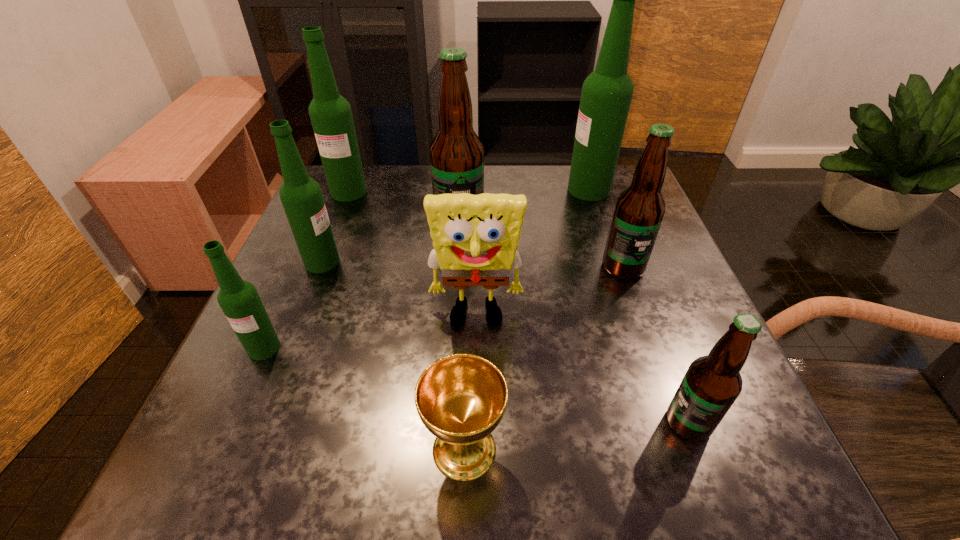
Identify which green beer bottle is the second nearest to the second biggest green beer bottle. Please provide its 2D coordinates. Your answer should be formatted as a tuple, i.e. [(x, y)], where the tuple contains the x and y coordinates of a point satisfying the conditions above.

[(239, 300)]

Locate which brown beer bottle is the second closest to the nearest green beer bottle. Please provide its 2D coordinates. Your answer should be formatted as a tuple, i.e. [(x, y)], where the tuple contains the x and y coordinates of a point satisfying the conditions above.

[(639, 210)]

Locate which brown beer bottle ranks in proximity to the nearest beer bottle. Please provide its 2D coordinates. Your answer should be formatted as a tuple, i.e. [(x, y)], where the tuple contains the x and y coordinates of a point satisfying the conditions above.

[(639, 210)]

I want to click on free spot that satisfies the following two spatial constraints: 1. on the label of the rightmost green beer bottle; 2. on the label of the third smallest green beer bottle, so click(x=589, y=192).

Where is `free spot that satisfies the following two spatial constraints: 1. on the label of the third farthest beer bottle; 2. on the label of the second smallest green beer bottle`? The height and width of the screenshot is (540, 960). free spot that satisfies the following two spatial constraints: 1. on the label of the third farthest beer bottle; 2. on the label of the second smallest green beer bottle is located at coordinates (458, 262).

Where is `free space in the image that satisfies the following two spatial constraints: 1. on the label of the second nearest green beer bottle; 2. on the label of the third nearest object`? The image size is (960, 540). free space in the image that satisfies the following two spatial constraints: 1. on the label of the second nearest green beer bottle; 2. on the label of the third nearest object is located at coordinates tap(288, 348).

This screenshot has width=960, height=540. Find the location of `free location that satisfies the following two spatial constraints: 1. on the label of the rightmost green beer bottle; 2. on the label of the second biggest green beer bottle`. free location that satisfies the following two spatial constraints: 1. on the label of the rightmost green beer bottle; 2. on the label of the second biggest green beer bottle is located at coordinates (589, 192).